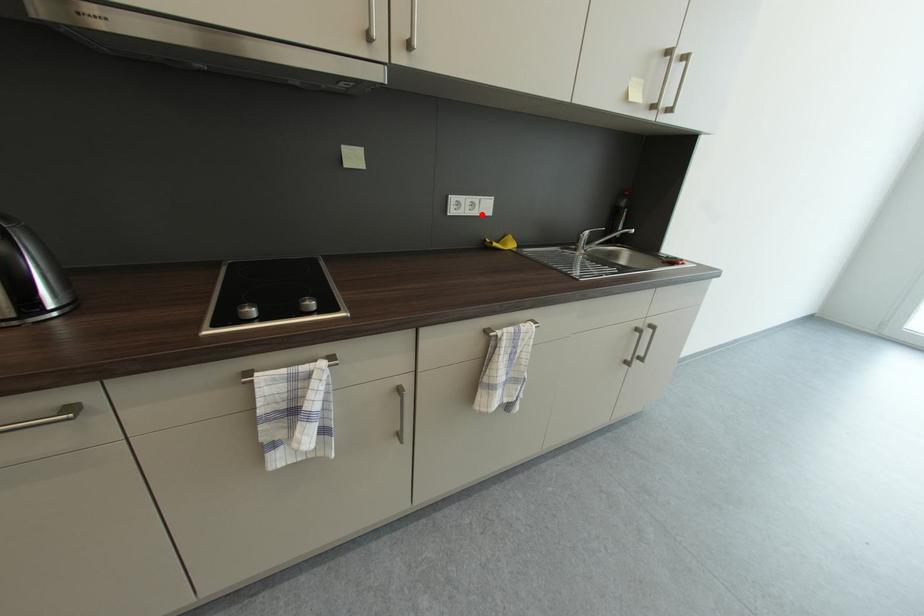
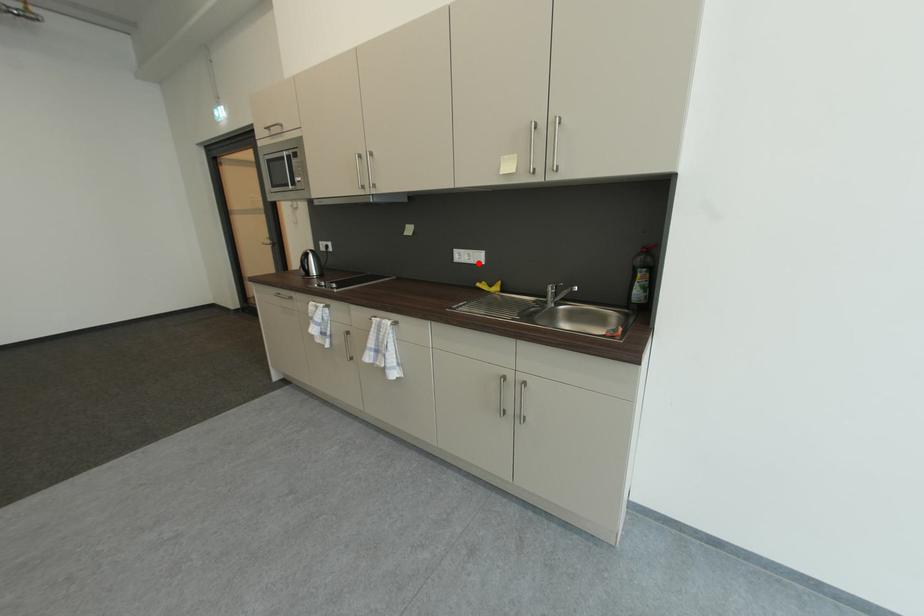
I am providing you with two images of the same scene from different viewpoints. A red point is marked on the first image and another point is marked on the second image. Does the point marked in image1 correspond to the same location as the one in image2?

Yes